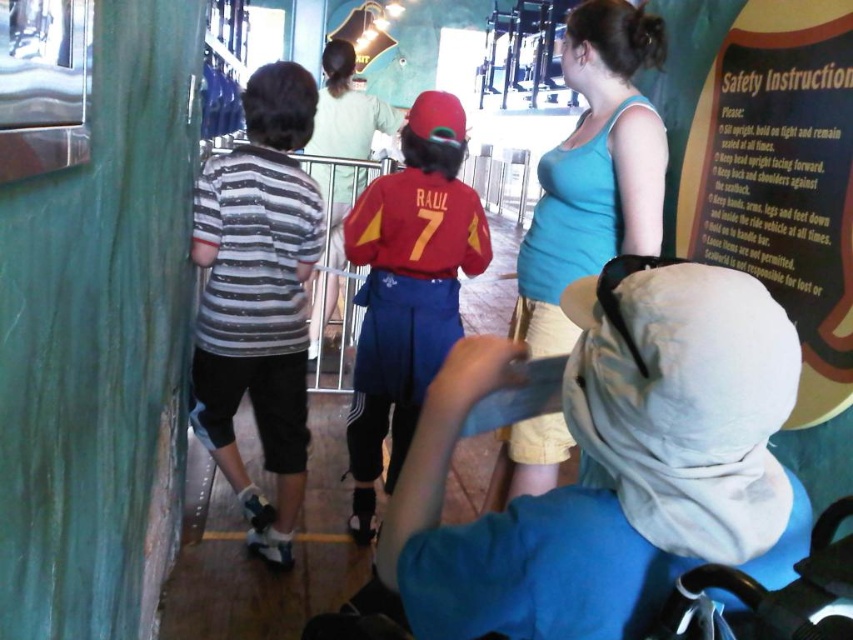
Can you confirm if striped cotton shirt at left is positioned above blue cotton tank top at upper center?

Incorrect, striped cotton shirt at left is not positioned above blue cotton tank top at upper center.

Which is in front, point (258, 364) or point (604, 227)?

Positioned in front is point (604, 227).

Locate an element on the screen. This screenshot has width=853, height=640. striped cotton shirt at left is located at coordinates (258, 298).

Which of these two, striped cotton shirt at left or matte red cap at center, stands shorter?

matte red cap at center

Does point (299, 328) come farther from viewer compared to point (439, 275)?

Yes, it is.

Locate an element on the screen. Image resolution: width=853 pixels, height=640 pixels. striped cotton shirt at left is located at coordinates (258, 298).

Is blue cotton tank top at upper center above matte red cap at center?

Yes, blue cotton tank top at upper center is above matte red cap at center.

Does point (590, 236) come behind point (395, 426)?

No, it is in front of (395, 426).

Which is in front, point (625, 230) or point (369, 381)?

Positioned in front is point (625, 230).

Find the location of `blue cotton tank top at upper center`. blue cotton tank top at upper center is located at coordinates (595, 170).